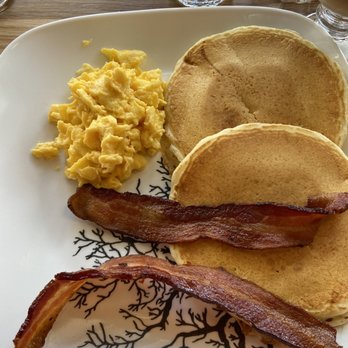
In order to click on plate decor in this screenshot , I will do `click(167, 308)`, `click(197, 329)`, `click(224, 319)`.